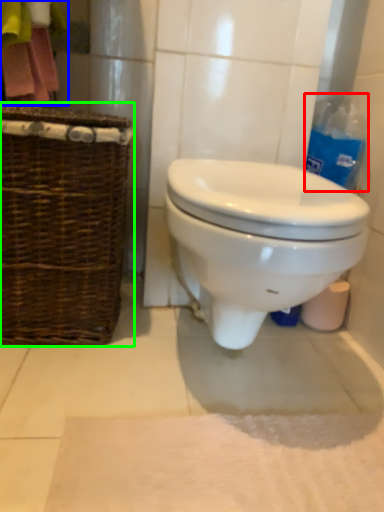
Question: Considering the real-world distances, which object is closest to cleaning product (highlighted by a red box)? laundry (highlighted by a blue box) or picnic basket (highlighted by a green box).

Choices:
 (A) laundry
 (B) picnic basket

Answer: (B)